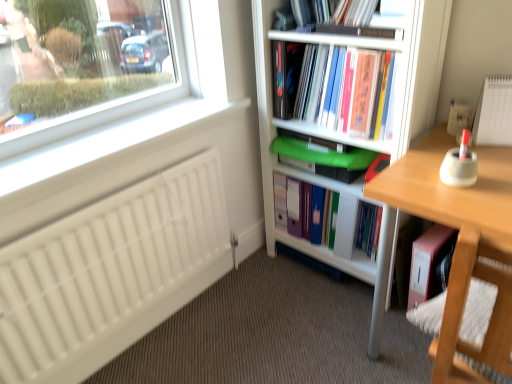
This screenshot has height=384, width=512. What are the coordinates of `free space in front of matte plastic shelf at center` in the screenshot? It's located at (318, 306).